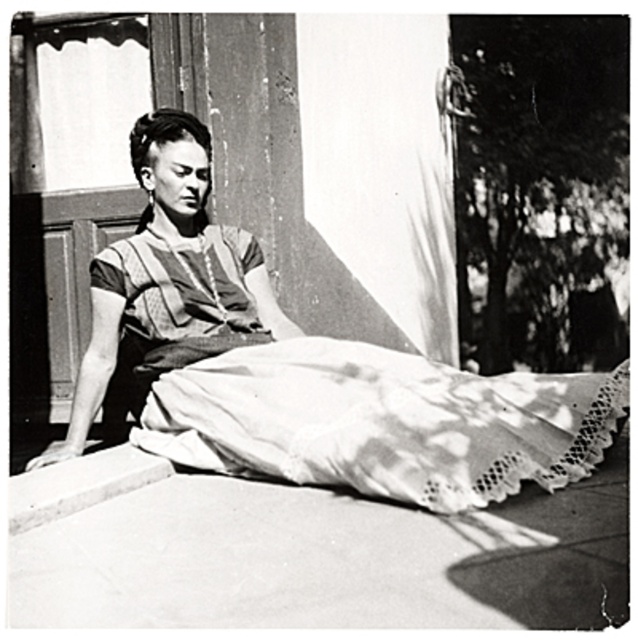
Looking at this image, between matte fabric dress at center and smooth concrete curb at lower left, which one is positioned higher?

matte fabric dress at center is above.

Who is more distant from viewer, (x=223, y=403) or (x=93, y=452)?

Point (x=93, y=452)

Who is more distant from viewer, (x=292, y=481) or (x=15, y=477)?

Positioned behind is point (x=15, y=477).

Locate an element on the screen. The height and width of the screenshot is (640, 638). matte fabric dress at center is located at coordinates (309, 371).